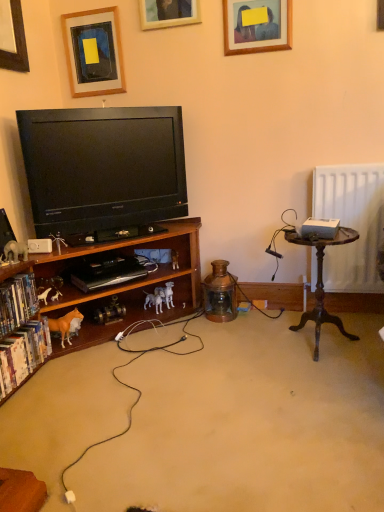
The height and width of the screenshot is (512, 384). I want to click on vacant space to the right of hardcover book at lower left, which is the first book from bottom to top, so click(66, 384).